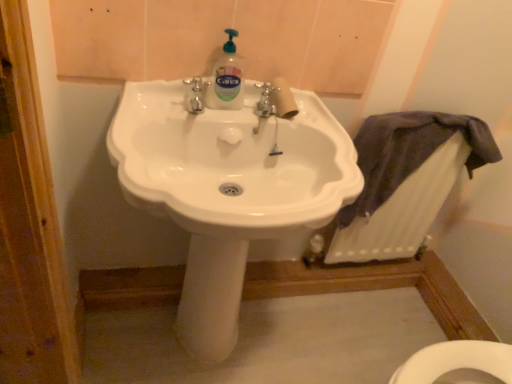
The height and width of the screenshot is (384, 512). I want to click on empty space that is ontop of white textured radiator at lower right (from a real-world perspective), so click(425, 118).